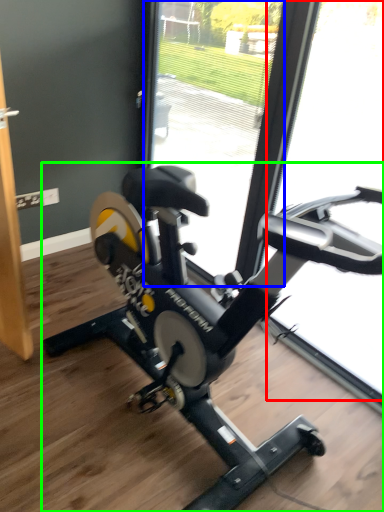
Question: Which object is the farthest from glass door (highlighted by a red box)? Choose among these: glass door (highlighted by a blue box) or stationary bicycle (highlighted by a green box).

Choices:
 (A) glass door
 (B) stationary bicycle

Answer: (B)